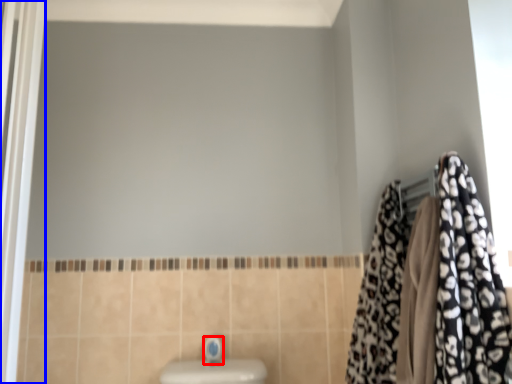
Question: Which object appears farthest to the camera in this image, faucet (highlighted by a red box) or screen door (highlighted by a blue box)?

Choices:
 (A) faucet
 (B) screen door

Answer: (A)